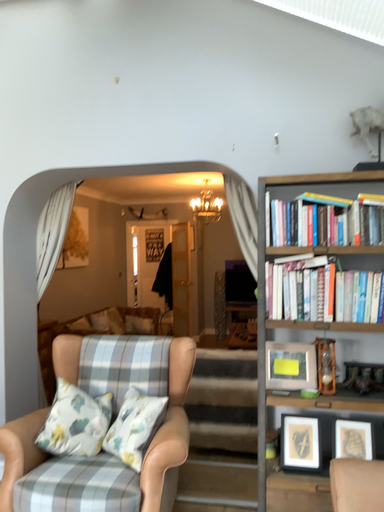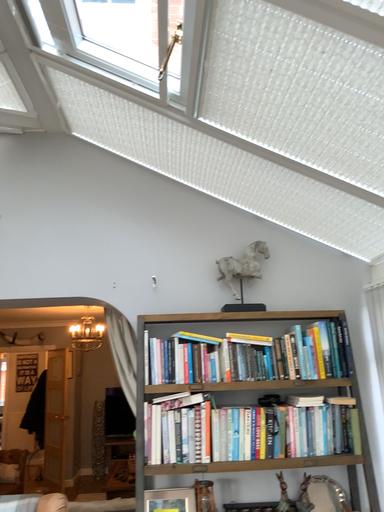
Question: How did the camera likely rotate when shooting the video?

Choices:
 (A) rotated upward
 (B) rotated downward

Answer: (A)